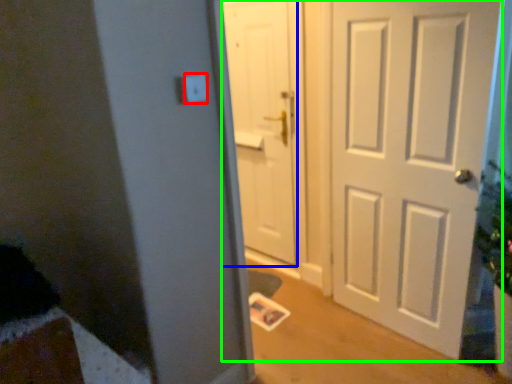
Question: Estimate the real-world distances between objects in this image. Which object is farther from light switch (highlighted by a red box), door (highlighted by a blue box) or door (highlighted by a green box)?

Choices:
 (A) door
 (B) door

Answer: (A)